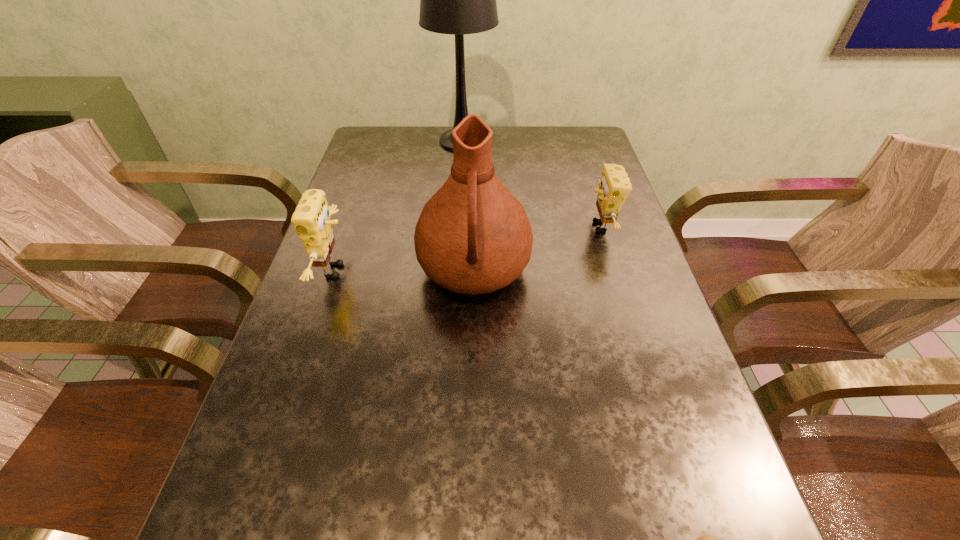
The height and width of the screenshot is (540, 960). In order to click on free space located 0.340m on the face of the right sponge in this screenshot , I will do `click(455, 227)`.

The height and width of the screenshot is (540, 960). In order to click on free space located on the face of the right sponge in this screenshot , I will do `click(474, 227)`.

This screenshot has width=960, height=540. What are the coordinates of `vacant space located 0.350m on the face of the right sponge` in the screenshot? It's located at (451, 227).

This screenshot has width=960, height=540. What are the coordinates of `object at the far edge` in the screenshot? It's located at (457, 0).

Locate an element on the screen. object that is at the left edge is located at coordinates (311, 220).

Image resolution: width=960 pixels, height=540 pixels. I want to click on object that is at the right edge, so click(614, 186).

Identify the location of free location at the far edge. The width and height of the screenshot is (960, 540). (538, 148).

The width and height of the screenshot is (960, 540). What are the coordinates of `vacant space at the left edge` in the screenshot? It's located at (300, 460).

You are a GUI agent. You are given a task and a screenshot of the screen. Output one action in this format:
    pyautogui.click(x=<x>, y=<y>)
    Task: Click on the vacant space at the right edge of the desktop
    Image resolution: width=960 pixels, height=540 pixels.
    Given the screenshot: What is the action you would take?
    pyautogui.click(x=684, y=471)

Identify the location of free space between the table lamp and the shorter sponge. This screenshot has width=960, height=540. pyautogui.click(x=532, y=184).